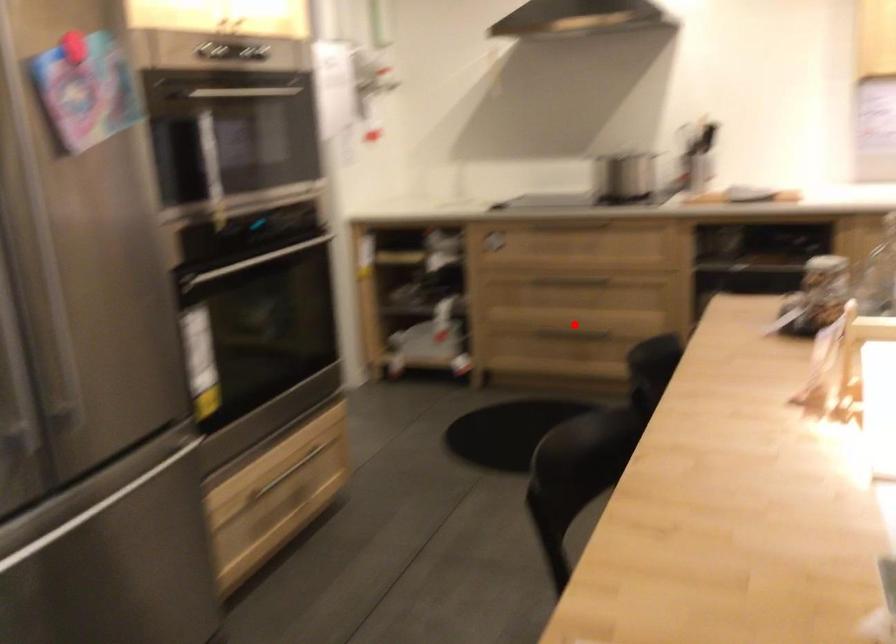
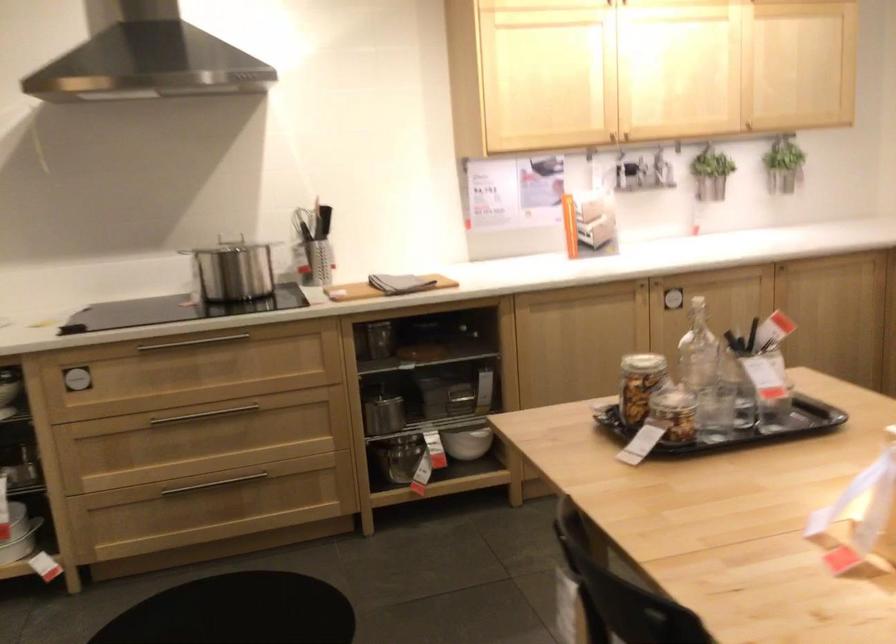
Question: A red point is marked in image1. In image2, is the corresponding 3D point closer to the camera or farther? Reply with the corresponding letter.

Choices:
 (A) The corresponding 3D point is closer.
 (B) The corresponding 3D point is farther.

Answer: (A)